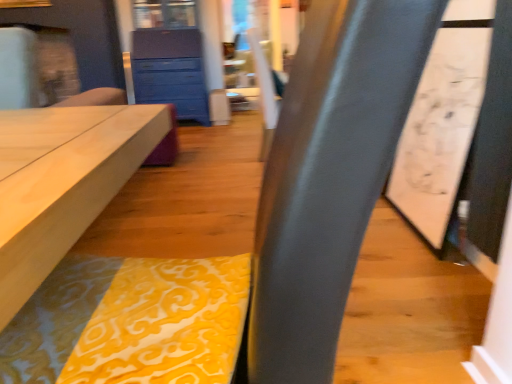
Question: From their relative heights in the image, would you say blue painted wood chest of drawers at upper center is taller or shorter than yellow damask fabric at center?

Choices:
 (A) tall
 (B) short

Answer: (A)

Question: From a real-world perspective, is blue painted wood chest of drawers at upper center above or below yellow damask fabric at center?

Choices:
 (A) below
 (B) above

Answer: (B)

Question: Visually, is blue painted wood chest of drawers at upper center positioned to the left or to the right of yellow damask fabric at center?

Choices:
 (A) right
 (B) left

Answer: (B)

Question: From a real-world perspective, is yellow damask fabric at center above or below blue painted wood chest of drawers at upper center?

Choices:
 (A) above
 (B) below

Answer: (B)

Question: From their relative heights in the image, would you say yellow damask fabric at center is taller or shorter than blue painted wood chest of drawers at upper center?

Choices:
 (A) tall
 (B) short

Answer: (B)

Question: Choose the correct answer: Is yellow damask fabric at center inside blue painted wood chest of drawers at upper center or outside it?

Choices:
 (A) outside
 (B) inside

Answer: (A)

Question: Considering the positions of point (15, 367) and point (163, 43), is point (15, 367) closer or farther from the camera than point (163, 43)?

Choices:
 (A) farther
 (B) closer

Answer: (B)